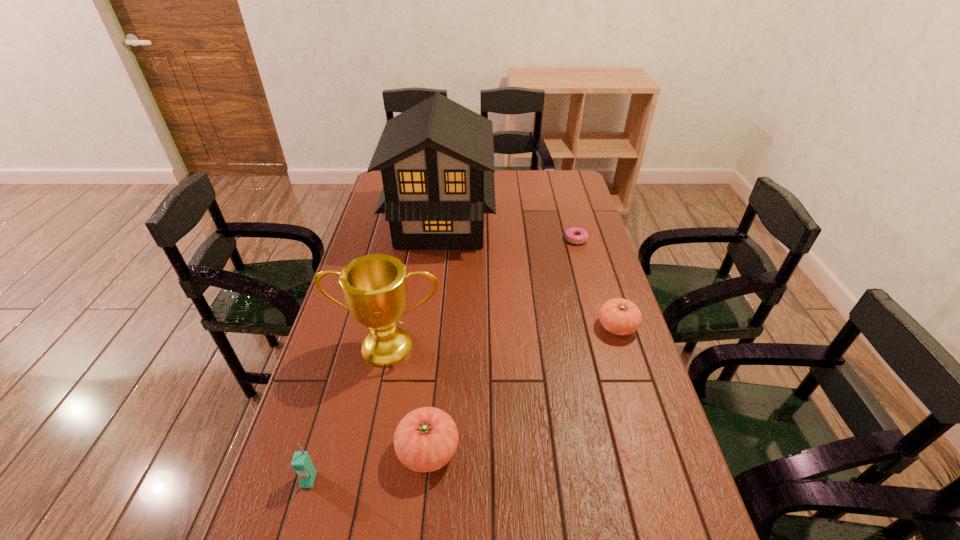
If equal spacing is desired by inserting an extra tomato among them, please point out a free spot for this new tomato. Please provide its 2D coordinates. Your answer should be formatted as a tuple, i.e. [(x, y)], where the tuple contains the x and y coordinates of a point satisfying the conditions above.

[(535, 381)]